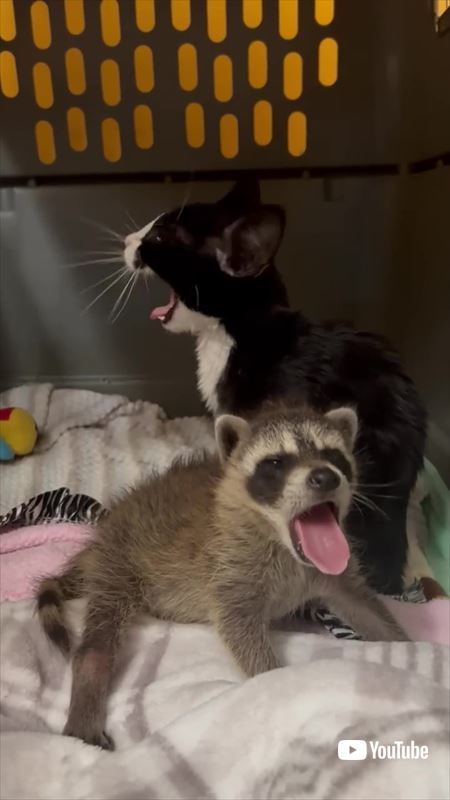
Where is `the lower carrier wall`? This screenshot has width=450, height=800. the lower carrier wall is located at coordinates (339, 260), (64, 286).